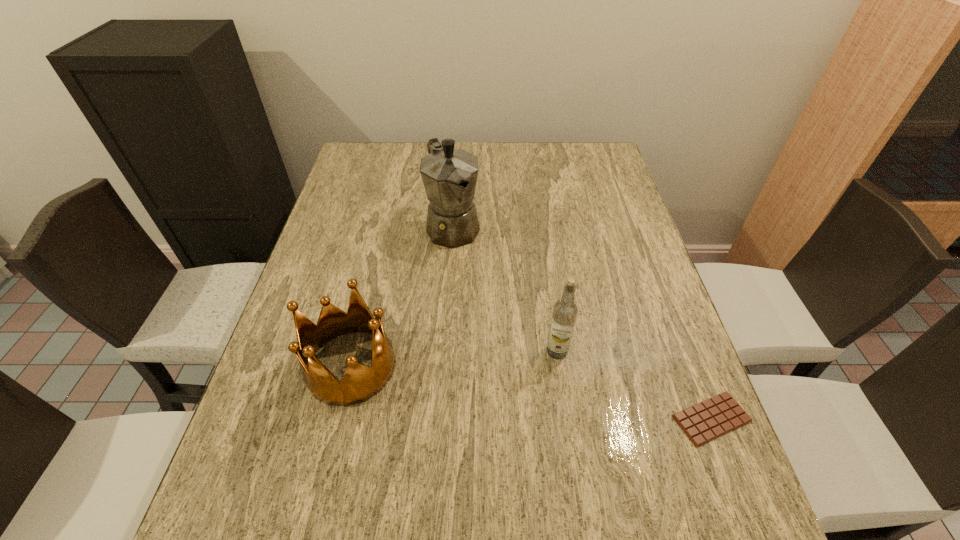
Locate an element on the screen. This screenshot has width=960, height=540. vacant space on the desktop that is between the second shortest object and the shortest object and is positioned on the pouring side of the farthest object is located at coordinates (564, 397).

This screenshot has height=540, width=960. Identify the location of free space on the desktop that is between the crown and the shortest object and is positioned on the label of the third shortest object. (x=472, y=383).